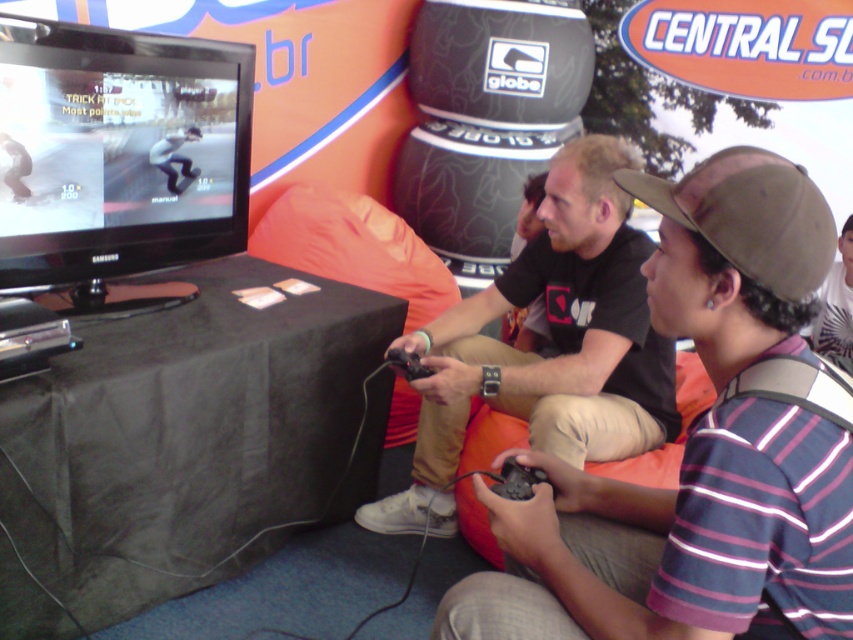
Question: Can you confirm if striped cotton shirt at center is wider than black matte shirt at center?

Choices:
 (A) no
 (B) yes

Answer: (A)

Question: Which object appears closest to the camera in this image?

Choices:
 (A) striped cotton shirt at center
 (B) brown fabric baseball cap at center-right

Answer: (A)

Question: Is striped cotton shirt at center closer to the viewer compared to brown fabric baseball cap at center-right?

Choices:
 (A) yes
 (B) no

Answer: (A)

Question: Among these points, which one is farthest from the camera?

Choices:
 (A) (514, 296)
 (B) (521, 628)

Answer: (A)

Question: Where is striped cotton shirt at center located in relation to brown fabric baseball cap at center-right in the image?

Choices:
 (A) above
 (B) below

Answer: (B)

Question: Which point is farther to the camera?

Choices:
 (A) black matte shirt at center
 (B) striped cotton shirt at center

Answer: (A)